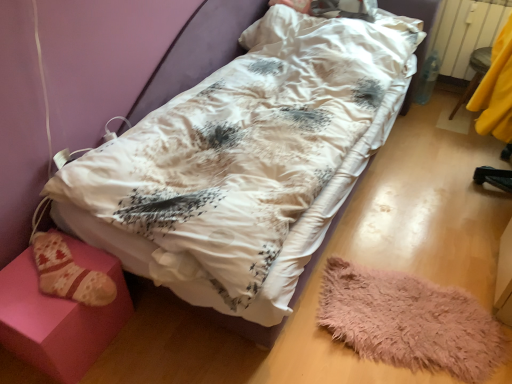
Question: Considering the relative sizes of white satin hospital bed at center and white plastic radiator at upper right in the image provided, is white satin hospital bed at center bigger than white plastic radiator at upper right?

Choices:
 (A) yes
 (B) no

Answer: (A)

Question: Is white satin hospital bed at center oriented towards white plastic radiator at upper right?

Choices:
 (A) no
 (B) yes

Answer: (A)

Question: Can you confirm if white satin hospital bed at center is taller than white plastic radiator at upper right?

Choices:
 (A) no
 (B) yes

Answer: (A)

Question: Considering the relative sizes of white satin hospital bed at center and white plastic radiator at upper right in the image provided, is white satin hospital bed at center smaller than white plastic radiator at upper right?

Choices:
 (A) no
 (B) yes

Answer: (A)

Question: Is white satin hospital bed at center outside of white plastic radiator at upper right?

Choices:
 (A) yes
 (B) no

Answer: (A)

Question: Is yellow fabric at right, placed as the 2th furniture when sorted from left to right, inside or outside of pink fabric stool at lower left, which appears as the first furniture when viewed from the left?

Choices:
 (A) outside
 (B) inside

Answer: (A)

Question: Is yellow fabric at right, the 2th furniture when ordered from bottom to top, bigger or smaller than pink fabric stool at lower left, acting as the 2th furniture starting from the right?

Choices:
 (A) small
 (B) big

Answer: (B)

Question: Considering the positions of yellow fabric at right, which ranks as the 1th furniture in back-to-front order, and pink fabric stool at lower left, which appears as the 1th furniture when viewed from the front, in the image, is yellow fabric at right, which ranks as the 1th furniture in back-to-front order, taller or shorter than pink fabric stool at lower left, which appears as the 1th furniture when viewed from the front,?

Choices:
 (A) tall
 (B) short

Answer: (A)

Question: Does point (457, 104) appear closer or farther from the camera than point (11, 324)?

Choices:
 (A) closer
 (B) farther

Answer: (B)

Question: Is point [29, 279] closer or farther from the camera than point [331, 170]?

Choices:
 (A) farther
 (B) closer

Answer: (B)

Question: In terms of height, does pink fabric stool at lower left, which is the 2th furniture in back-to-front order, look taller or shorter compared to white satin hospital bed at center?

Choices:
 (A) tall
 (B) short

Answer: (A)

Question: Would you say pink fabric stool at lower left, the first furniture ordered from the bottom, is inside or outside white satin hospital bed at center?

Choices:
 (A) inside
 (B) outside

Answer: (B)

Question: Considering the positions of pink fabric stool at lower left, the second furniture viewed from the top, and white satin hospital bed at center in the image, is pink fabric stool at lower left, the second furniture viewed from the top, wider or thinner than white satin hospital bed at center?

Choices:
 (A) thin
 (B) wide

Answer: (A)

Question: In terms of height, does white satin hospital bed at center look taller or shorter compared to pink fabric stool at lower left, the first furniture ordered from the bottom?

Choices:
 (A) short
 (B) tall

Answer: (A)

Question: Is white satin hospital bed at center to the left or to the right of pink fabric stool at lower left, which appears as the 1th furniture when viewed from the front, in the image?

Choices:
 (A) left
 (B) right

Answer: (B)